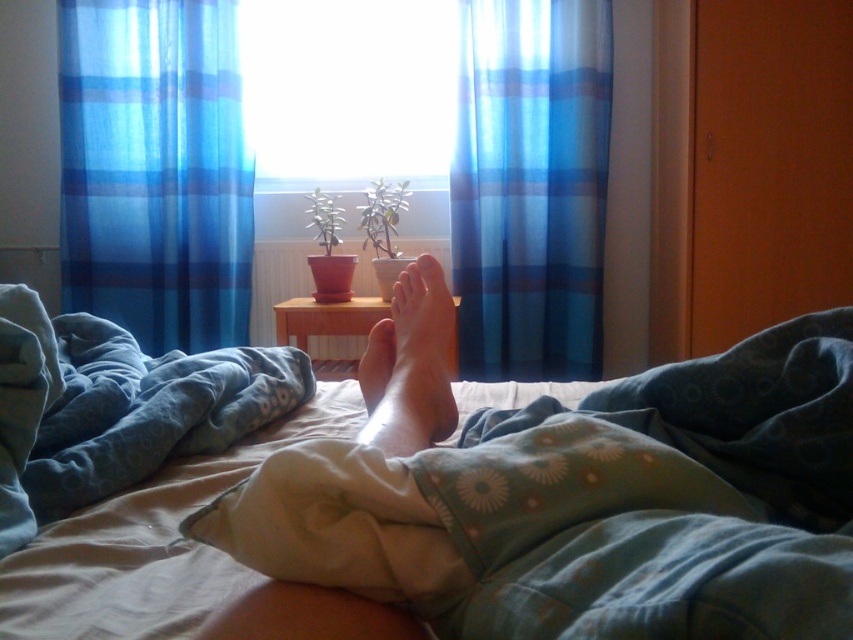
How far apart are blue soft blanket at lower center and transparent glass window at center?

blue soft blanket at lower center is 2.12 meters from transparent glass window at center.

Is point (105, 365) more distant than point (422, 177)?

No, (105, 365) is closer to viewer.

Is point (61, 348) in front of point (311, 180)?

Yes, it is.

Where is `blue soft blanket at lower center`? The height and width of the screenshot is (640, 853). blue soft blanket at lower center is located at coordinates (114, 408).

Describe the element at coordinates (531, 186) in the screenshot. I see `blue plaid curtain at upper center` at that location.

Is blue plaid curtain at upper center wider than transparent glass window at center?

Incorrect, blue plaid curtain at upper center's width does not surpass transparent glass window at center's.

Is point (467, 328) farther from camera compared to point (291, 16)?

No, it is in front of (291, 16).

Locate an element on the screen. The height and width of the screenshot is (640, 853). blue plaid curtain at upper center is located at coordinates (531, 186).

Based on the photo, is blue soft blanket at lower center wider than smooth skin foot at center?

Yes.

Does point (105, 468) lie behind point (416, 424)?

Yes.

Describe the element at coordinates (114, 408) in the screenshot. This screenshot has height=640, width=853. I see `blue soft blanket at lower center` at that location.

Where is `blue soft blanket at lower center`? The width and height of the screenshot is (853, 640). blue soft blanket at lower center is located at coordinates (114, 408).